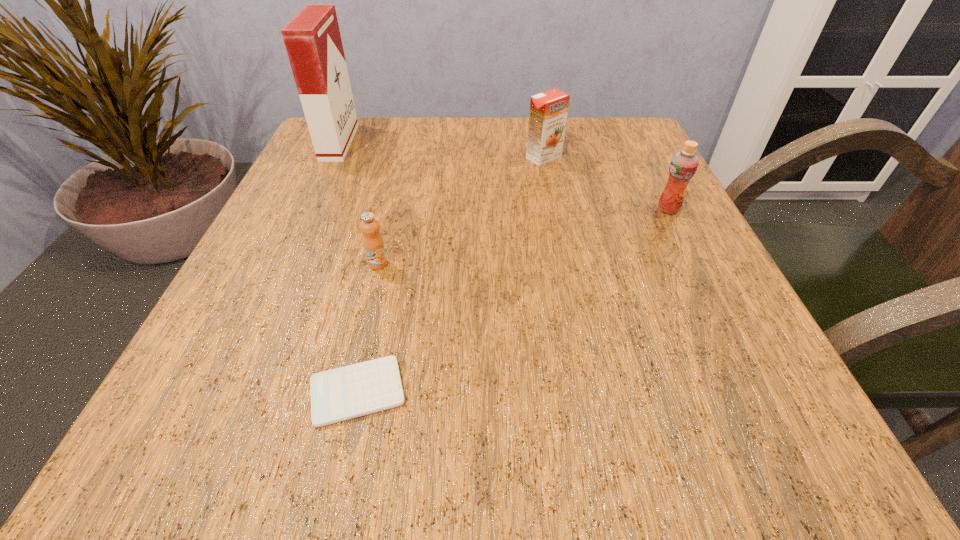
Locate an element on the screen. object that is positioned at the far left corner is located at coordinates (312, 38).

Locate an element on the screen. This screenshot has width=960, height=540. blank area at the far edge is located at coordinates (422, 153).

In the image, there is a desktop. Identify the location of vacant space at the near edge. (460, 436).

The height and width of the screenshot is (540, 960). I want to click on vacant space at the left edge of the desktop, so click(327, 202).

The height and width of the screenshot is (540, 960). I want to click on vacant space at the right edge of the desktop, so click(598, 194).

The width and height of the screenshot is (960, 540). In the image, there is a desktop. What are the coordinates of `vacant space at the far right corner` in the screenshot? It's located at (581, 154).

Identify the location of blank region between the second orange juice from right to left and the second shortest object. (461, 210).

At what (x,y) coordinates should I click in order to perform the action: click on vacant space that's between the second farthest orange juice and the leftmost object. Please return your answer as a coordinate pair (x, y). This screenshot has height=540, width=960. Looking at the image, I should click on (504, 176).

Find the location of a particular element. This screenshot has width=960, height=540. free space between the calculator and the tallest object is located at coordinates (348, 267).

Where is `free point between the calculator and the rightmost object`? free point between the calculator and the rightmost object is located at coordinates click(513, 300).